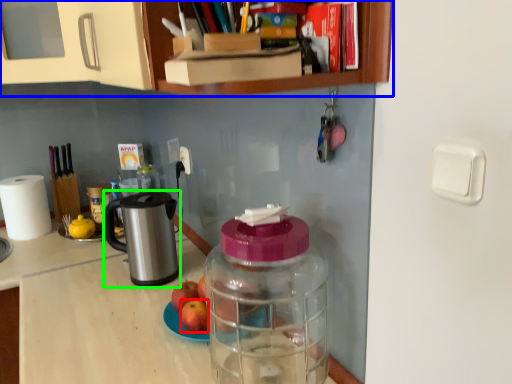
Question: Estimate the real-world distances between objects in this image. Which object is farther from apple (highlighted by a red box), cabinetry (highlighted by a blue box) or appliance (highlighted by a green box)?

Choices:
 (A) cabinetry
 (B) appliance

Answer: (A)